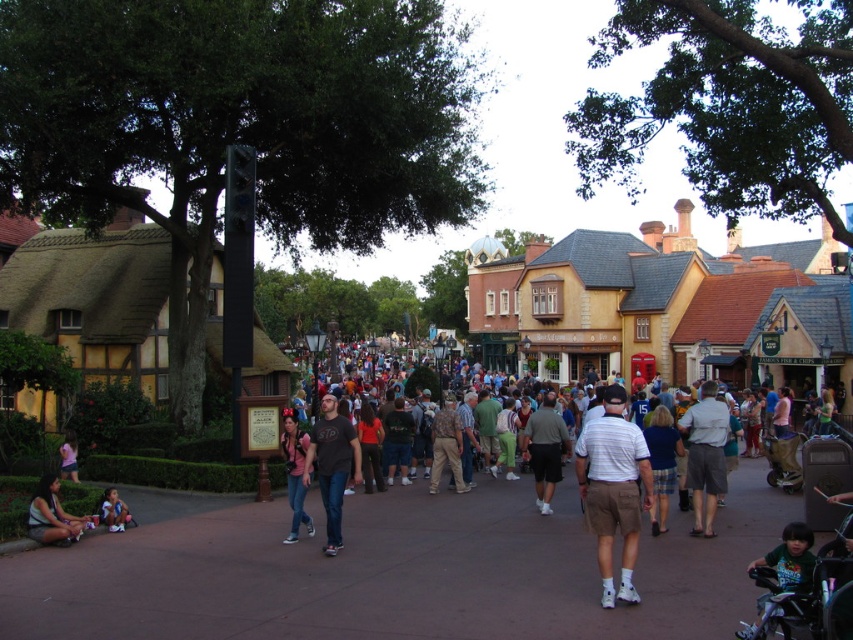
You are a photographer standing at the entrance of the theme park and see a person wearing a striped cotton shirt at center and matte blue shorts at lower left. Which piece of clothing is more to the left?

The matte blue shorts at lower left are more to the left because the striped cotton shirt at center is positioned on the right side of them.

You are a photographer standing at the center of the pathway in the theme park. You want to take a photo of the striped cotton shirt at center and the matte blue shorts at lower left. Which object is covering the other in the image?

The striped cotton shirt at center is positioned over matte blue shorts at lower left, so the striped cotton shirt at center is covering the matte blue shorts at lower left in the image.

You are standing on the pathway in the theme park and notice both the brown concrete pavement at center and the denim jeans at center. Which object is positioned lower in the scene?

The brown concrete pavement at center is located below denim jeans at center, so it is positioned lower in the scene.